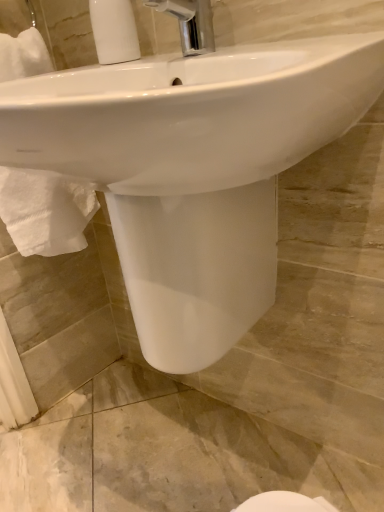
Question: Is white ribbed plastic at upper left situated inside chrome metallic faucet at upper center or outside?

Choices:
 (A) inside
 (B) outside

Answer: (B)

Question: Looking at the image, does white ribbed plastic at upper left seem bigger or smaller compared to chrome metallic faucet at upper center?

Choices:
 (A) small
 (B) big

Answer: (A)

Question: Which object is positioned closest to the white glossy sink at center?

Choices:
 (A) chrome metallic faucet at upper center
 (B) white ribbed plastic at upper left

Answer: (A)

Question: Estimate the real-world distances between objects in this image. Which object is farther from the white ribbed plastic at upper left?

Choices:
 (A) chrome metallic faucet at upper center
 (B) white glossy sink at center

Answer: (B)